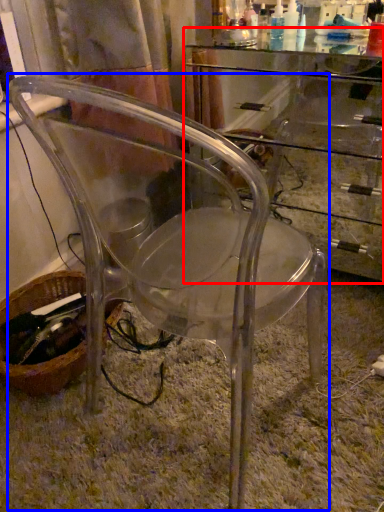
Question: Which of the following is the farthest to the observer, computer desk (highlighted by a red box) or chair (highlighted by a blue box)?

Choices:
 (A) computer desk
 (B) chair

Answer: (A)